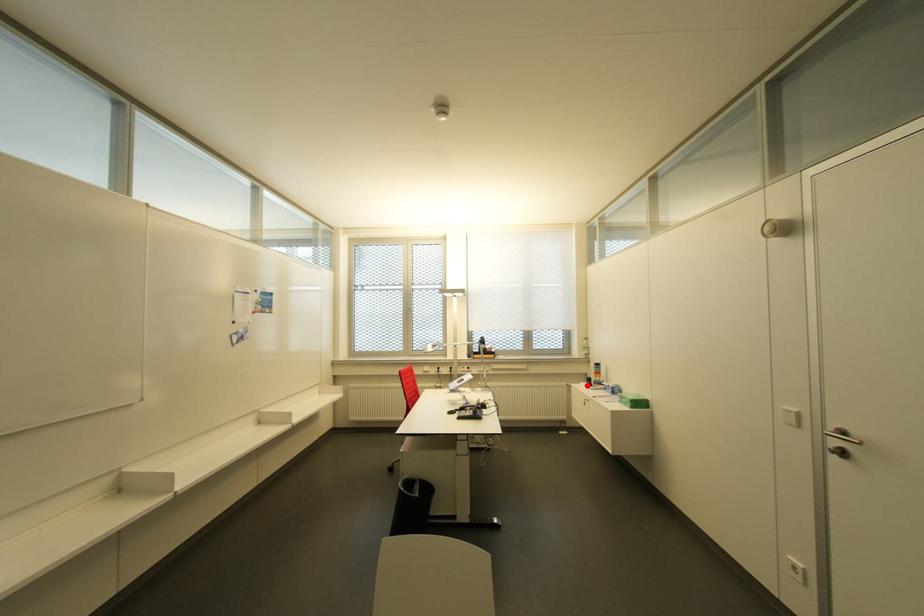
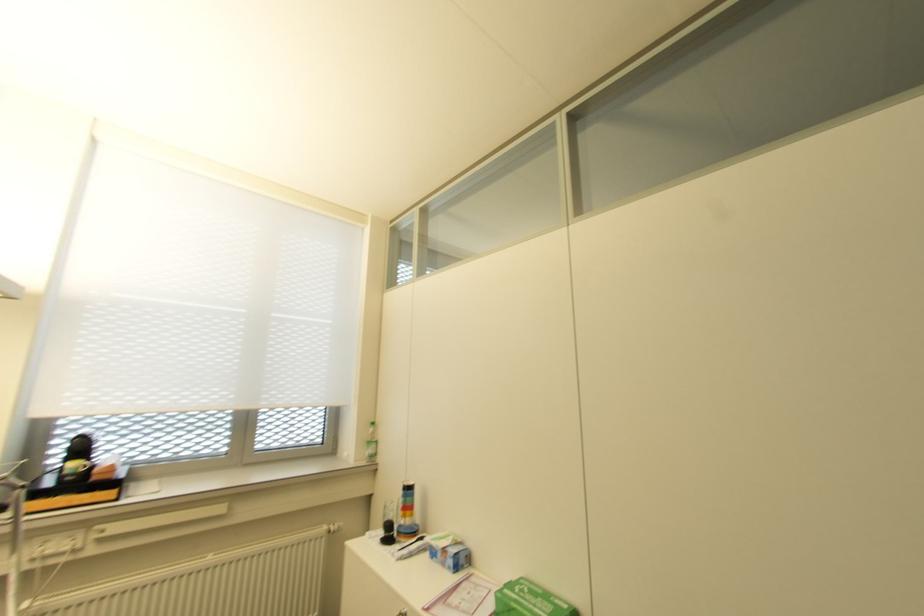
Question: I am providing you with two images of the same scene from different viewpoints. Given a red point in image1, look at the same physical point in image2. Is it:

Choices:
 (A) Closer to the viewpoint
 (B) Farther from the viewpoint

Answer: (B)